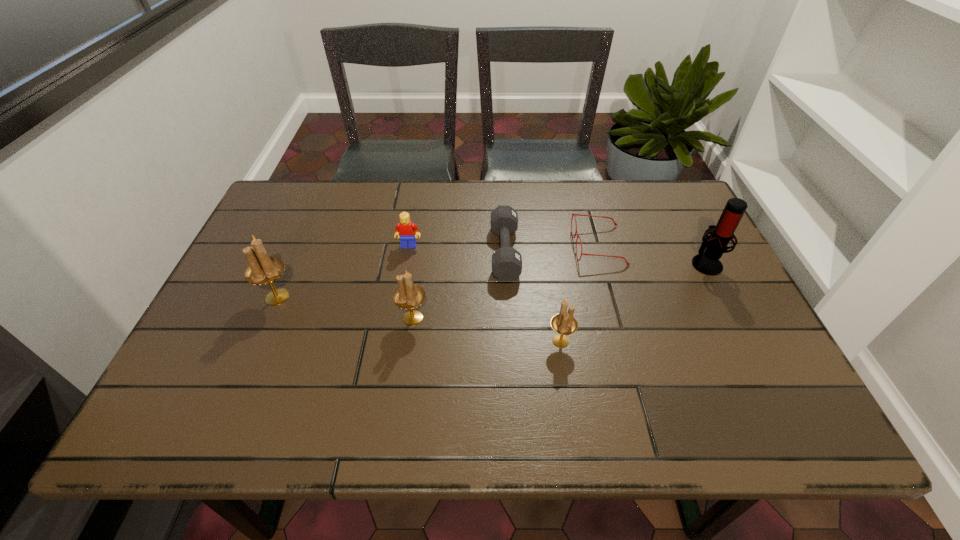
Where is `the leftmost object`? the leftmost object is located at coordinates (x=262, y=269).

At what (x,y) coordinates should I click in order to perform the action: click on the leftmost candle holder. Please return your answer as a coordinate pair (x, y). This screenshot has height=540, width=960. Looking at the image, I should click on (262, 269).

Where is `the fifth shortest object`? This screenshot has height=540, width=960. the fifth shortest object is located at coordinates (408, 295).

Image resolution: width=960 pixels, height=540 pixels. I want to click on the second tallest candle holder, so click(x=408, y=295).

Identify the location of the fifth object from left to right. The width and height of the screenshot is (960, 540). [564, 323].

The width and height of the screenshot is (960, 540). Identify the location of the fourth shortest object. (564, 323).

Identify the location of the sixth object from left to right. (627, 263).

Find the location of a particular element. the shortest object is located at coordinates (627, 263).

At what (x,y) coordinates should I click in order to perform the action: click on the rightmost object. Please return your answer as a coordinate pair (x, y). Image resolution: width=960 pixels, height=540 pixels. Looking at the image, I should click on (713, 246).

Where is `dumbbell`? dumbbell is located at coordinates (506, 261).